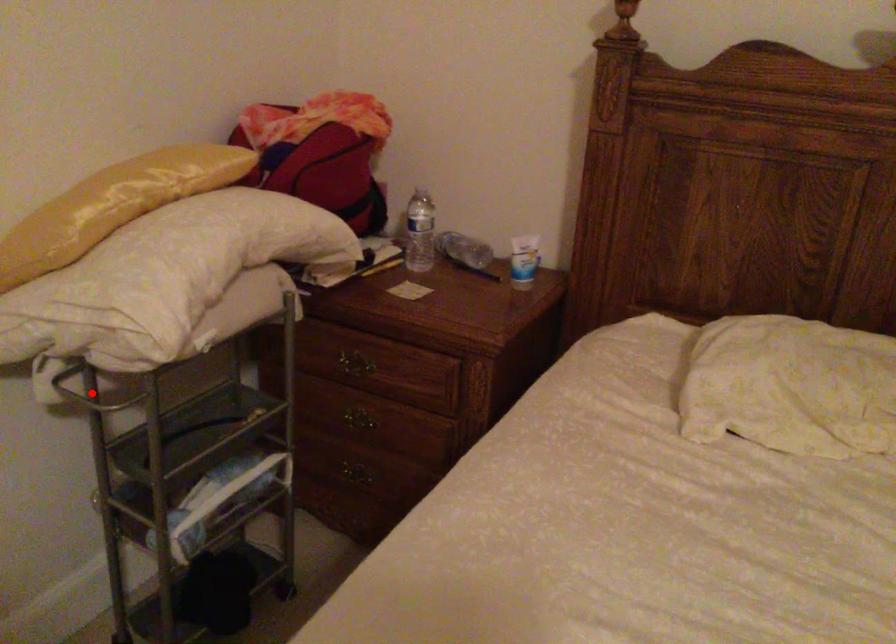
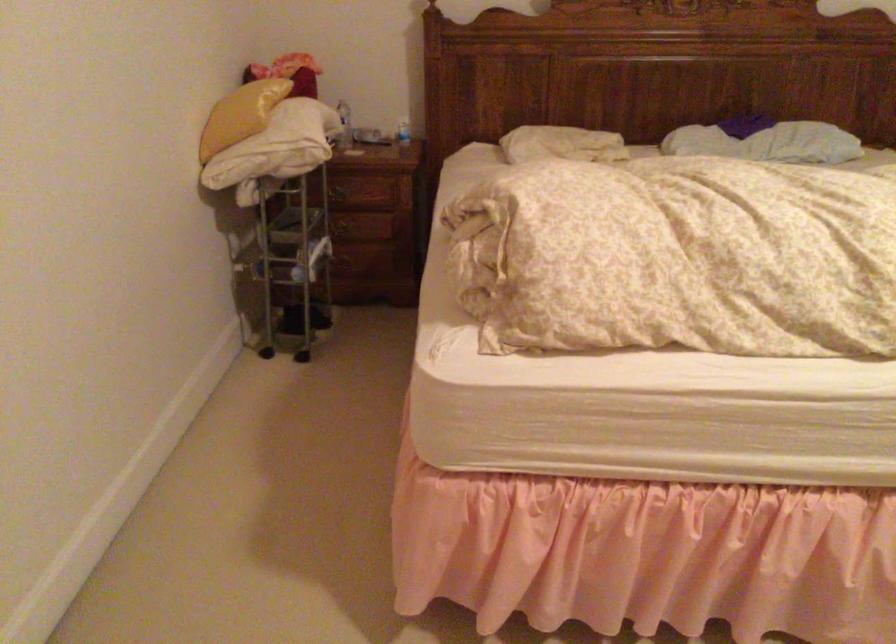
Question: I am providing you with two images of the same scene from different viewpoints. A red point is marked on the first image. Can you still see the location of the red point in image 2?

Choices:
 (A) Yes
 (B) No

Answer: (B)